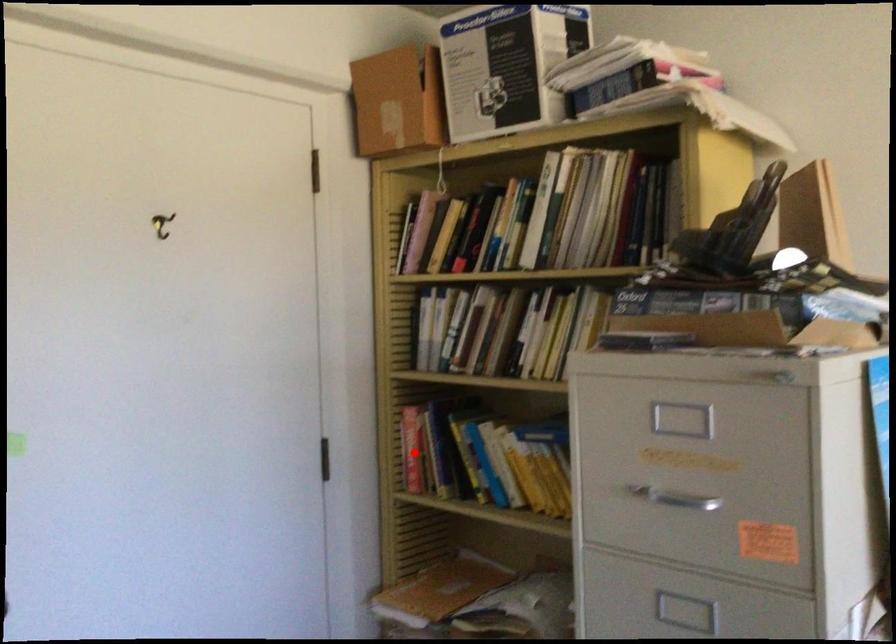
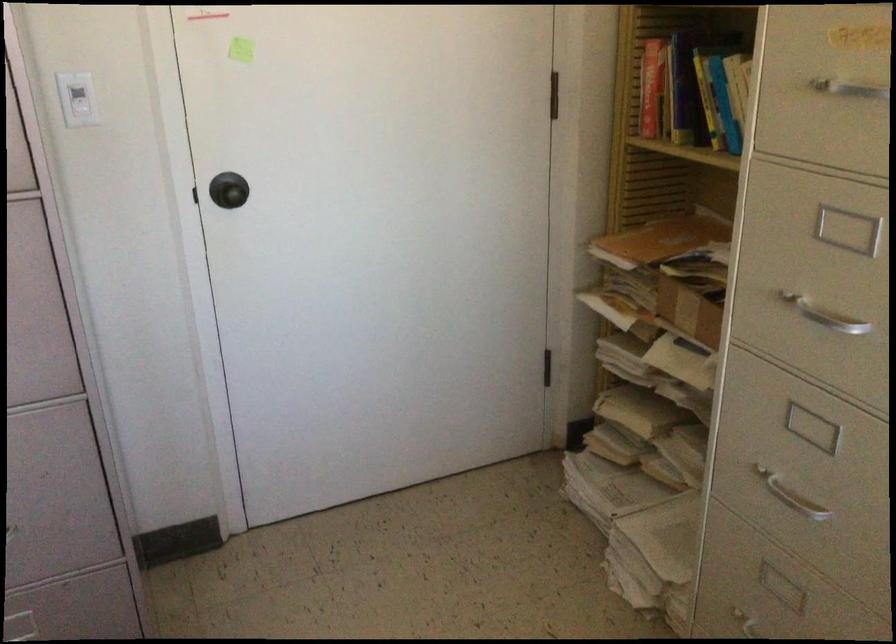
Where in the second image is the point corresponding to the highlighted location from the first image?

(650, 88)